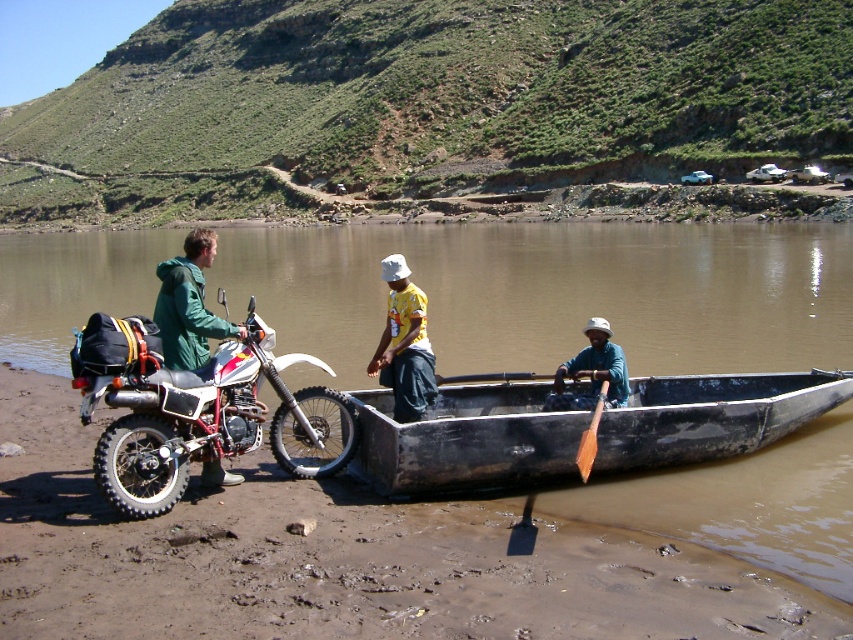
You are standing at the riverbank and want to take a photo of the matte black motorcycle at left and the yellow fabric shirt at center. Which object should you focus on first to ensure both are in clear view?

You should focus on the matte black motorcycle at left first because it is closer to you than the yellow fabric shirt at center. This ensures both will be in focus as you adjust the camera.